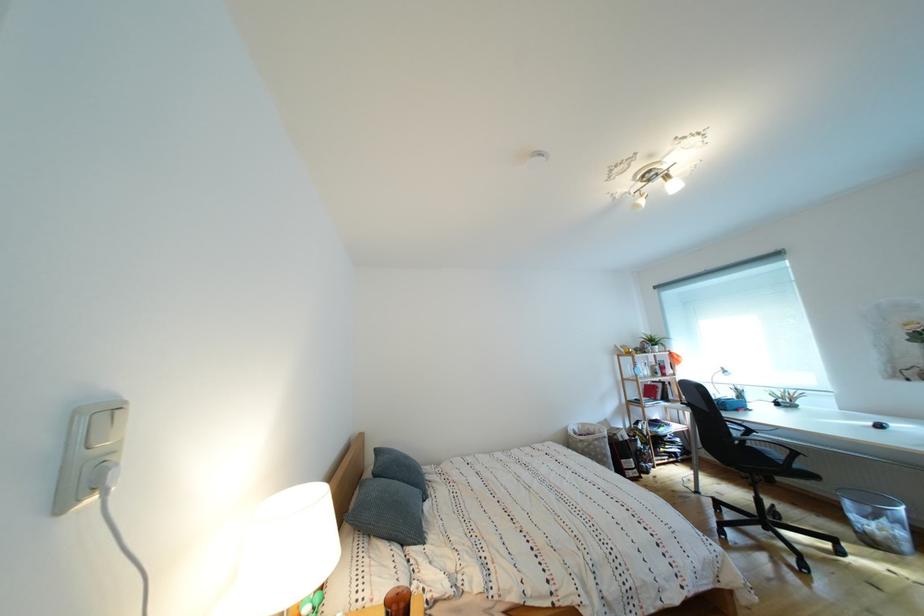
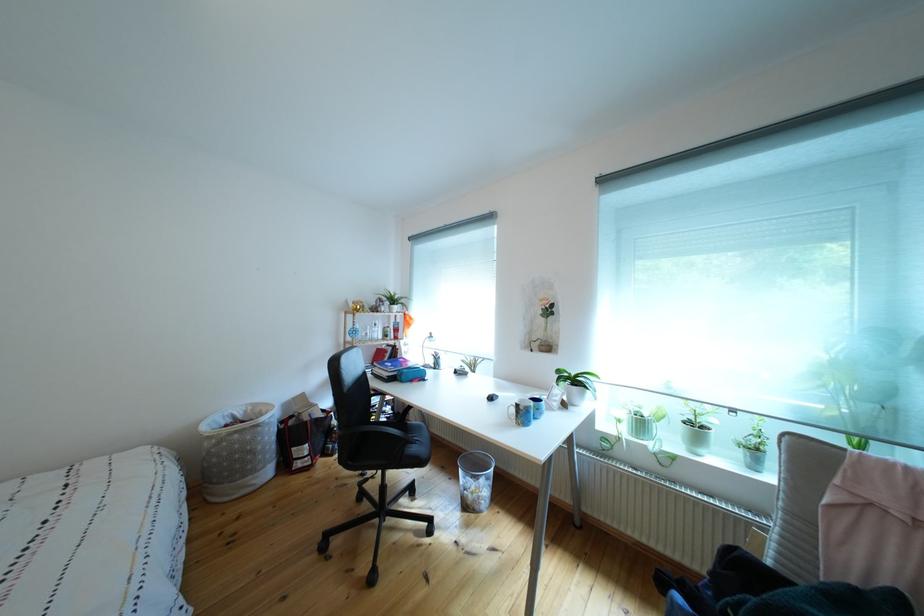
Find the pixel in the second image that matches (x=616, y=461) in the first image.

(263, 456)